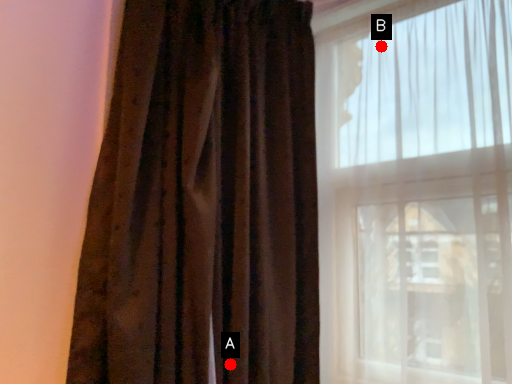
Question: Two points are circled on the image, labeled by A and B beside each circle. Among these points, which one is farthest from the camera?

Choices:
 (A) A is further
 (B) B is further

Answer: (B)